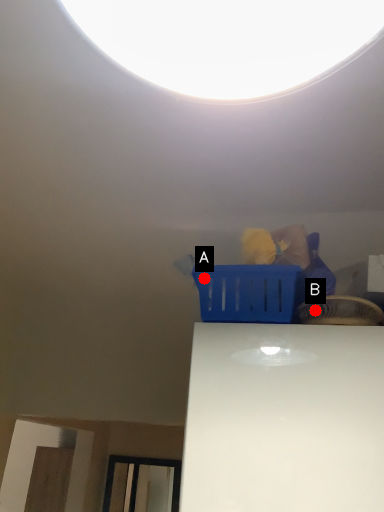
Question: Two points are circled on the image, labeled by A and B beside each circle. Which point is closer to the camera?

Choices:
 (A) A is closer
 (B) B is closer

Answer: (B)